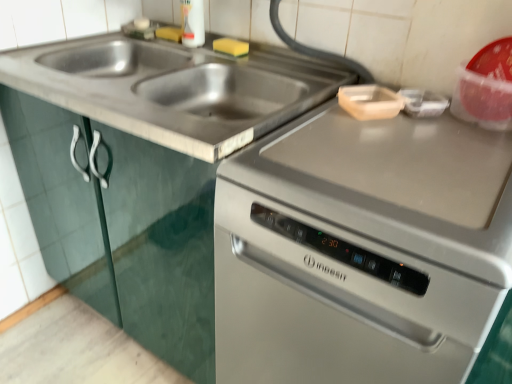
I want to click on free point in front of yellow sponge at upper center, so click(231, 64).